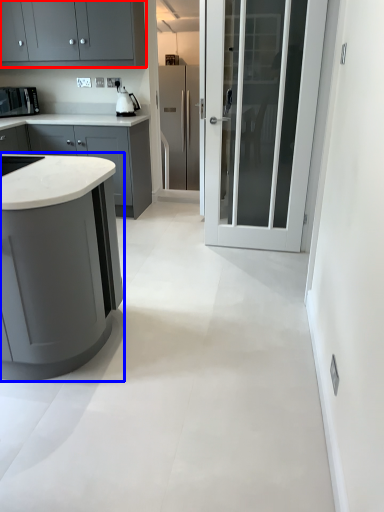
Question: Which of the following is the farthest to the observer, cabinetry (highlighted by a red box) or cabinetry (highlighted by a blue box)?

Choices:
 (A) cabinetry
 (B) cabinetry

Answer: (A)